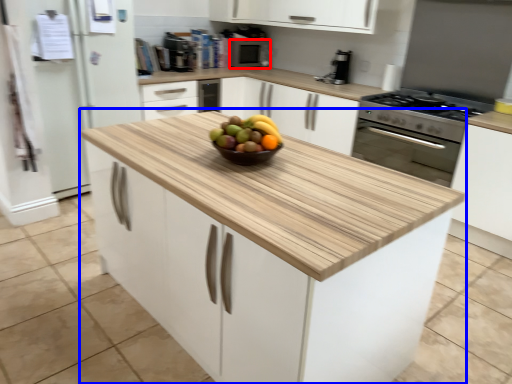
Question: Which object is further to the camera taking this photo, appliance (highlighted by a red box) or cabinetry (highlighted by a blue box)?

Choices:
 (A) appliance
 (B) cabinetry

Answer: (A)